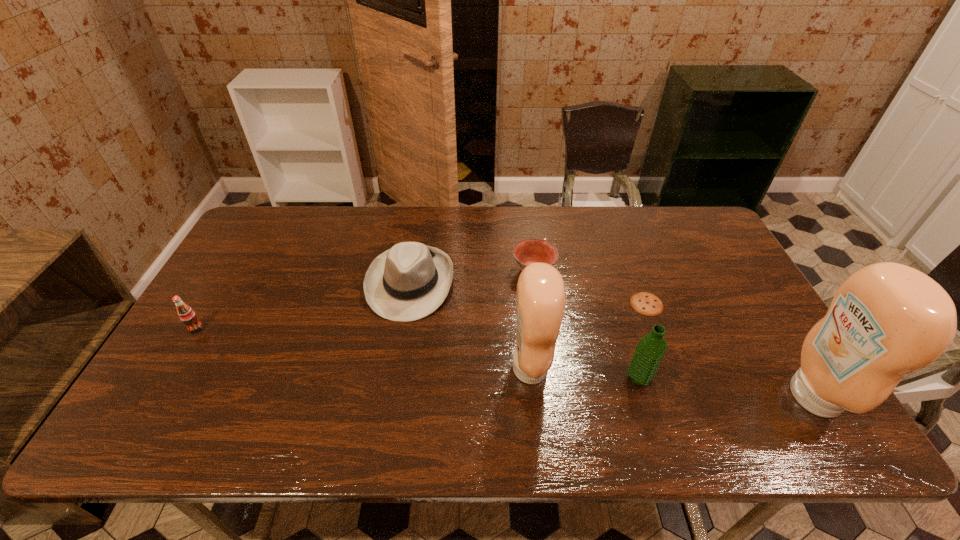
Where is `free space located on the right of the fifth shortest object`? free space located on the right of the fifth shortest object is located at coordinates (742, 377).

Locate an element on the screen. The width and height of the screenshot is (960, 540). object that is at the far edge is located at coordinates (409, 281).

Where is `water bottle situated at the near edge`? water bottle situated at the near edge is located at coordinates (650, 350).

I want to click on object situated at the left edge, so click(x=187, y=315).

Identify the location of object that is at the right edge. (886, 320).

The height and width of the screenshot is (540, 960). Find the location of `object that is at the near right corner`. object that is at the near right corner is located at coordinates (886, 320).

The height and width of the screenshot is (540, 960). In the image, there is a desktop. Find the location of `vacant space at the far edge`. vacant space at the far edge is located at coordinates (321, 248).

The height and width of the screenshot is (540, 960). In the image, there is a desktop. What are the coordinates of `vacant space at the near edge` in the screenshot? It's located at (337, 386).

You are a GUI agent. You are given a task and a screenshot of the screen. Output one action in this format:
    pyautogui.click(x=<x>, y=<y>)
    Task: Click on the vacant region at the left edge of the desktop
    This screenshot has width=960, height=540.
    Given the screenshot: What is the action you would take?
    pyautogui.click(x=212, y=362)

You are a GUI agent. You are given a task and a screenshot of the screen. Output one action in this format:
    pyautogui.click(x=<x>, y=<y>)
    Task: Click on the blank space at the right edge of the desktop
    
    Given the screenshot: What is the action you would take?
    pyautogui.click(x=699, y=269)